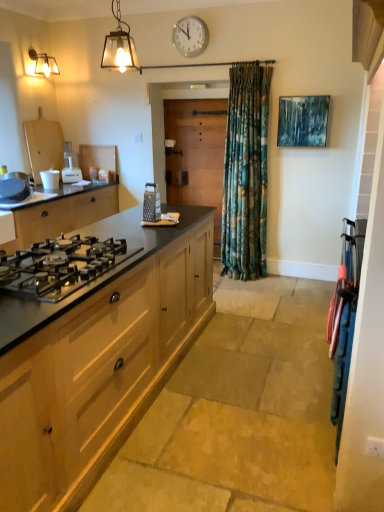
At what (x,y) coordinates should I click in order to perform the action: click on free location in front of silver metallic grater at center, positioned as the 4th appliance in top-to-bottom order. Please return your answer as a coordinate pair (x, y). Looking at the image, I should click on pos(144,226).